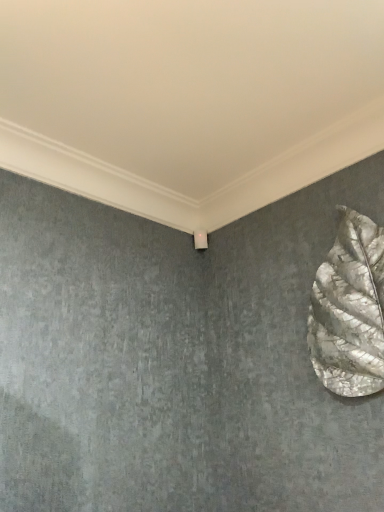
Where is `silver metallic leaf at upper right`? This screenshot has height=512, width=384. silver metallic leaf at upper right is located at coordinates (350, 309).

This screenshot has height=512, width=384. What do you see at coordinates (350, 309) in the screenshot?
I see `silver metallic leaf at upper right` at bounding box center [350, 309].

Image resolution: width=384 pixels, height=512 pixels. What are the coordinates of `silver metallic leaf at upper right` in the screenshot? It's located at (350, 309).